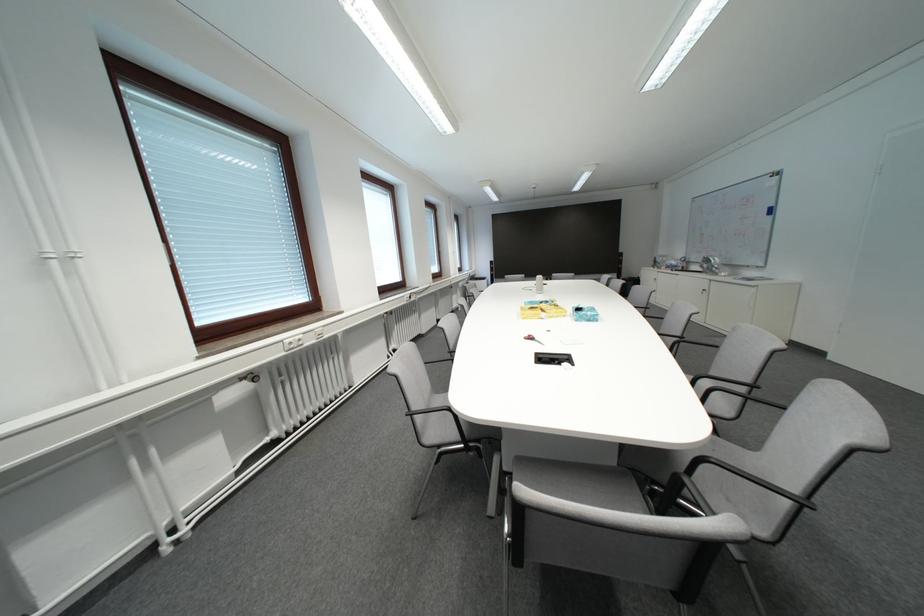
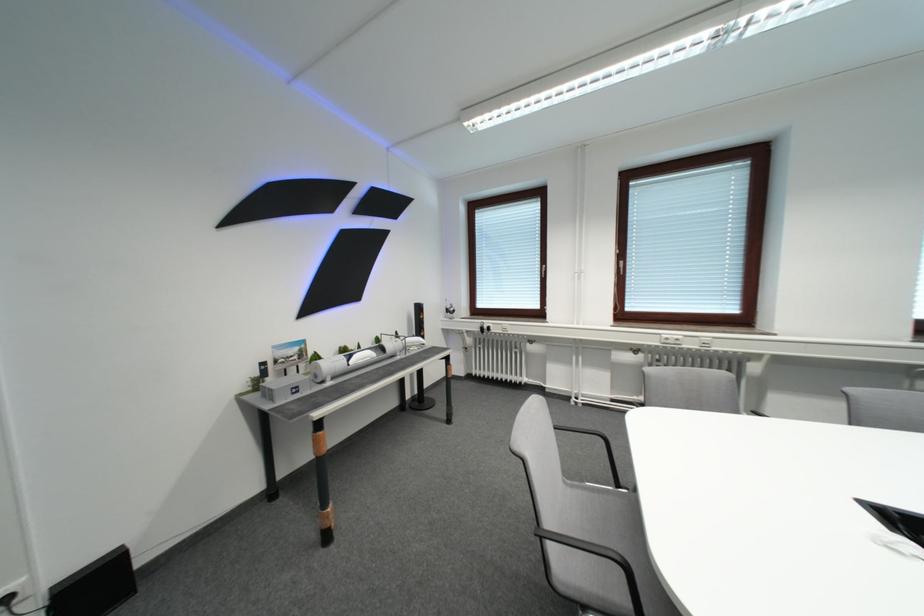
In the second image, find the point that corresponds to point (199, 537) in the first image.

(590, 408)